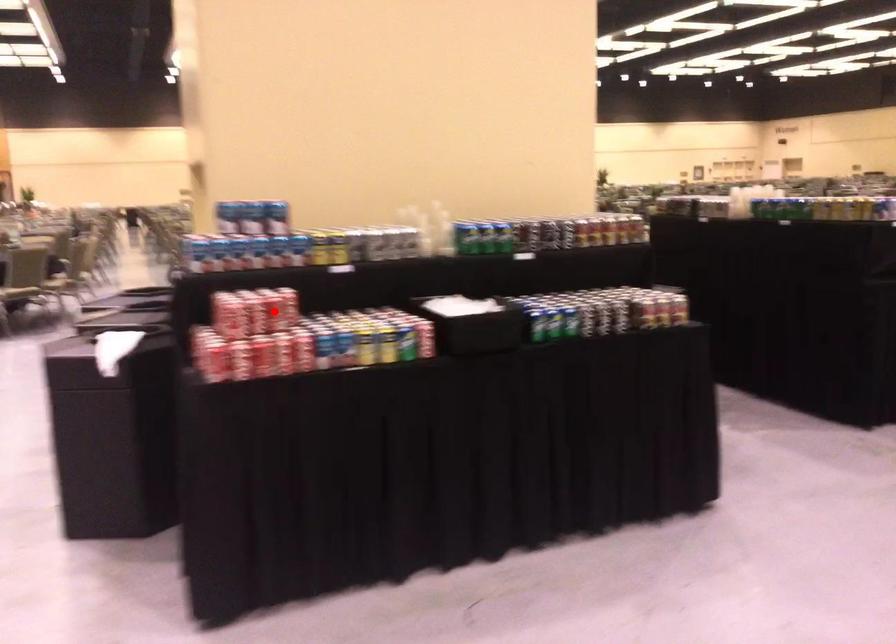
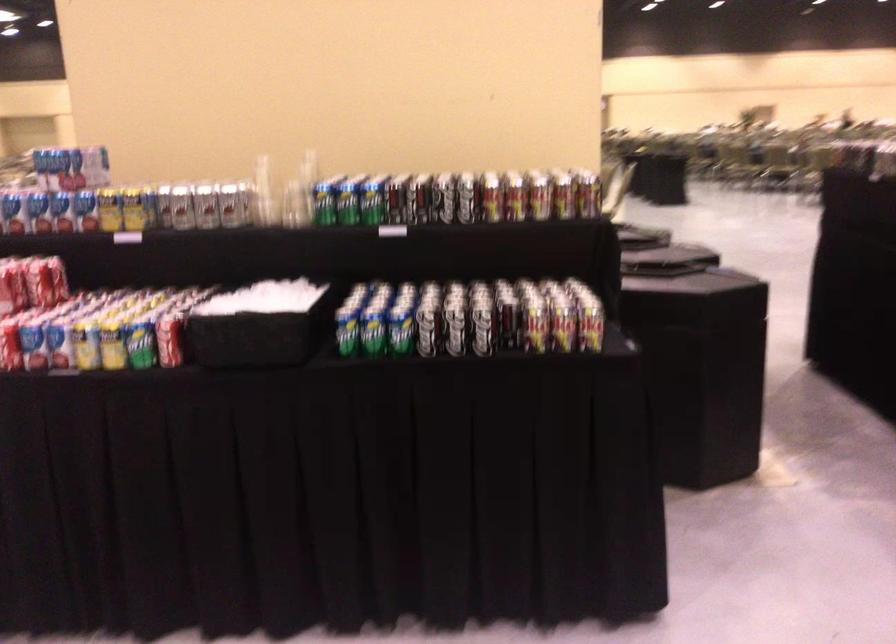
Where in the second image is the point corresponding to the highlighted location from the first image?

(12, 287)